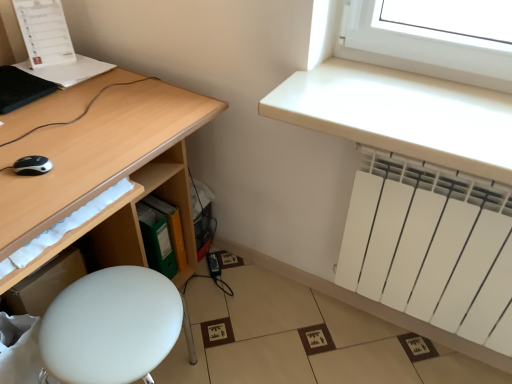
Question: Does white matte radiator at lower right have a larger size compared to green plastic file at lower center?

Choices:
 (A) yes
 (B) no

Answer: (A)

Question: Considering the relative positions of white matte radiator at lower right and green plastic file at lower center in the image provided, is white matte radiator at lower right to the right of green plastic file at lower center from the viewer's perspective?

Choices:
 (A) no
 (B) yes

Answer: (B)

Question: Considering the relative sizes of white matte radiator at lower right and green plastic file at lower center in the image provided, is white matte radiator at lower right smaller than green plastic file at lower center?

Choices:
 (A) yes
 (B) no

Answer: (B)

Question: From a real-world perspective, is white matte radiator at lower right over green plastic file at lower center?

Choices:
 (A) no
 (B) yes

Answer: (B)

Question: Is white matte radiator at lower right shorter than green plastic file at lower center?

Choices:
 (A) yes
 (B) no

Answer: (B)

Question: Is white matte radiator at lower right thinner than green plastic file at lower center?

Choices:
 (A) no
 (B) yes

Answer: (B)

Question: Would you say white matte radiator at upper right is part of white matte radiator at lower right's contents?

Choices:
 (A) no
 (B) yes

Answer: (A)

Question: Is white matte radiator at lower right not near white matte radiator at upper right?

Choices:
 (A) no
 (B) yes

Answer: (A)

Question: Can you confirm if white matte radiator at lower right is shorter than white matte radiator at upper right?

Choices:
 (A) yes
 (B) no

Answer: (B)

Question: Can you confirm if white matte radiator at lower right is taller than white matte radiator at upper right?

Choices:
 (A) yes
 (B) no

Answer: (A)

Question: Is white matte radiator at lower right not inside white matte radiator at upper right?

Choices:
 (A) no
 (B) yes

Answer: (B)

Question: From the image's perspective, is white matte radiator at lower right beneath white matte radiator at upper right?

Choices:
 (A) no
 (B) yes

Answer: (B)

Question: Would you say matte wood desk at left is a long distance from white matte radiator at lower right?

Choices:
 (A) yes
 (B) no

Answer: (B)